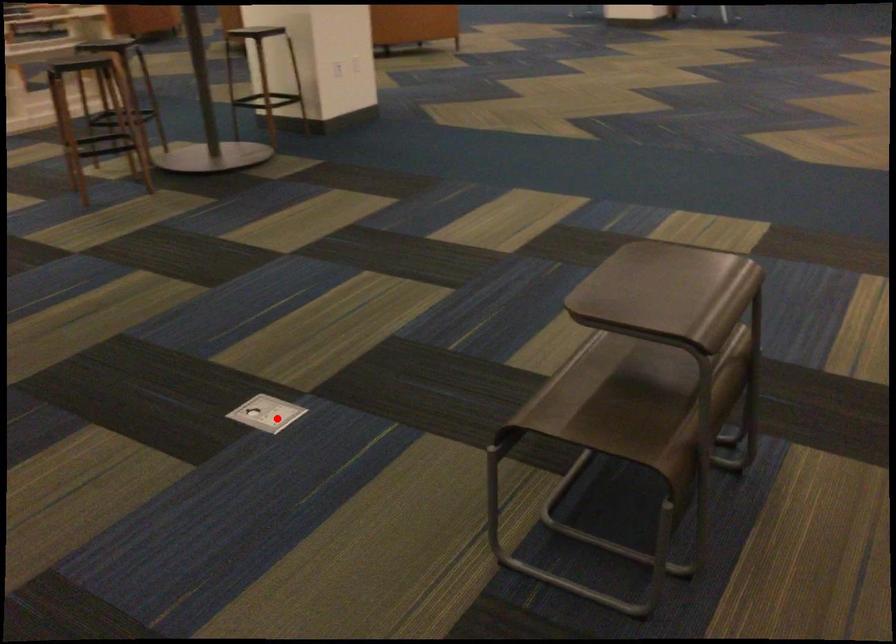
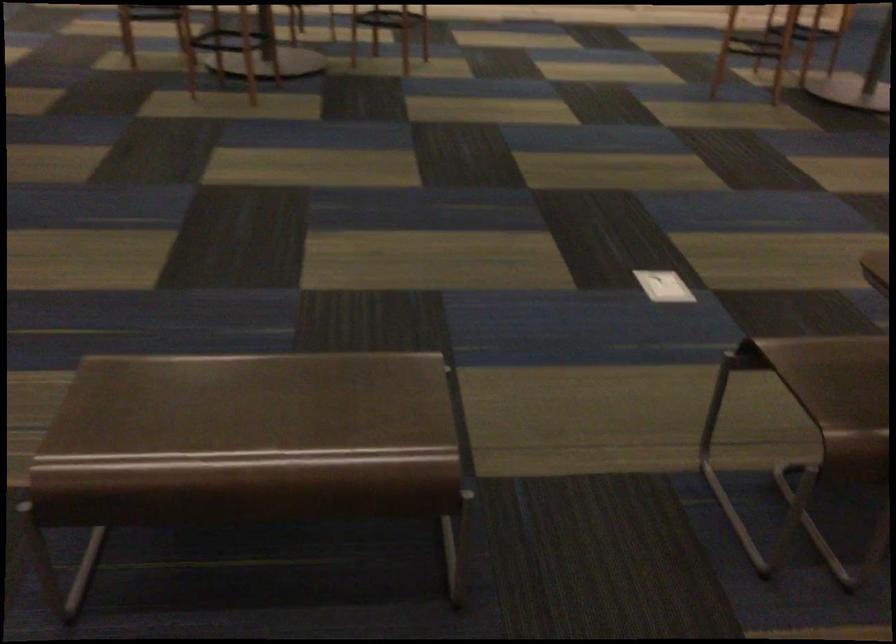
The point at the highlighted location is marked in the first image. Where is the corresponding point in the second image?

(664, 286)